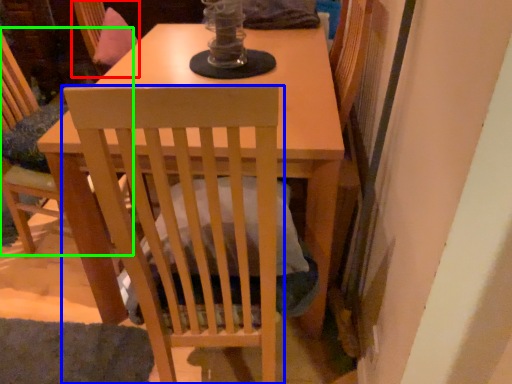
Question: Which is nearer to the swivel chair (highlighted by a red box)? chair (highlighted by a blue box) or chair (highlighted by a green box).

Choices:
 (A) chair
 (B) chair

Answer: (B)